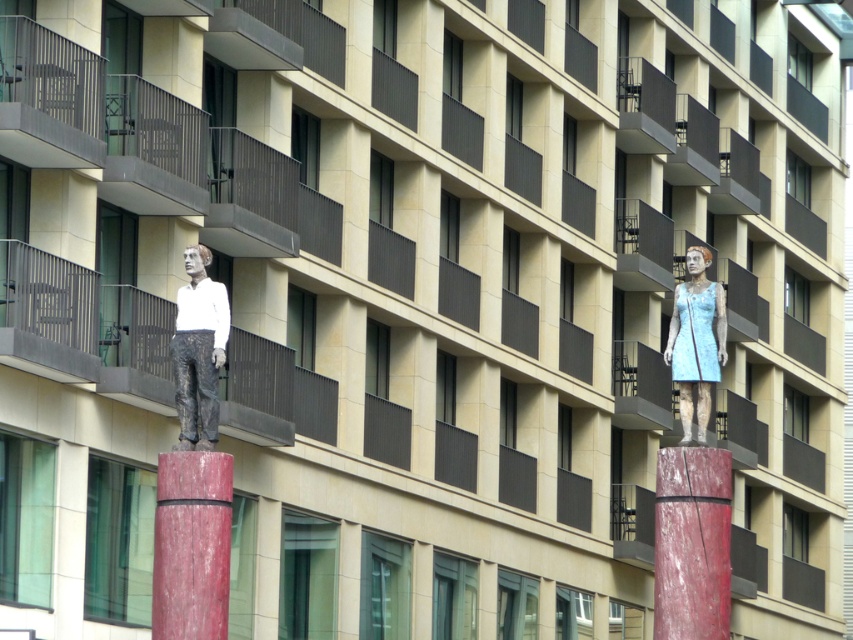
You are a maintenance worker needing to replace a loose tile between the smooth red wood at center and the smooth red wood pillar at center. Given that your ladder is 25 feet long, will it be sufficient to reach both objects?

Answer: The distance between the smooth red wood at center and the smooth red wood pillar at center is 28.97 feet. Since the ladder is only 25 feet long, it will not be sufficient to reach both objects as the distance exceeds the ladder length.

You are a visitor standing in front of the building and see the matte white statue at center and the blue fabric dress at right. Which sculpture is positioned to the right side?

The blue fabric dress at right is positioned to the right side.

You are an architect inspecting the building and notice two objects in the foreground. You see the smooth red wood at center and the smooth red wood pillar at center. Which one is positioned lower in the scene?

The smooth red wood at center is positioned lower than the smooth red wood pillar at center because it is located below it.